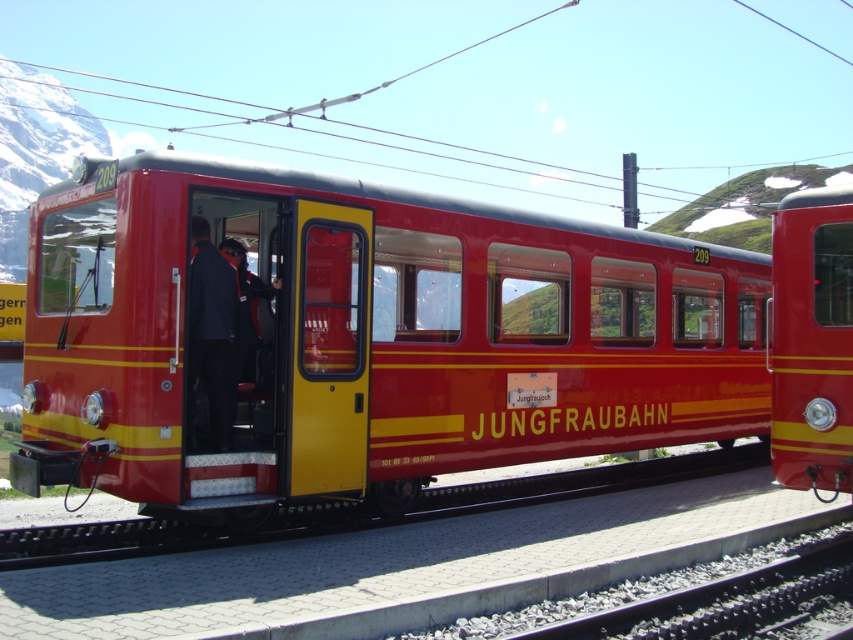
You are a photographer wanting to capture both the matte red train car at center and the metallic red train at right in a single shot. Based on their positions, which train should you position closer to the left side of your camera frame to include both?

You should position the matte red train car at center closer to the left side of your camera frame since it is already to the left of the metallic red train at right.

You are a photographer planning to capture both the matte red train car at center and the metallic red train at right in a single frame. Given their widths, which train should you position closer to the camera to ensure both fit without cropping?

Since the matte red train car at center is wider than the metallic red train at right, you should position the metallic red train at right closer to the camera to accommodate their differing widths in the frame.

You are standing at the center of the platform and want to board the metallic red train at right. Based on your position, is the train located to your left or right side?

The metallic red train at right is located at point 0.533 on the x axis, which is to the right of the center point at 0.5. Therefore, the train is to your right side.